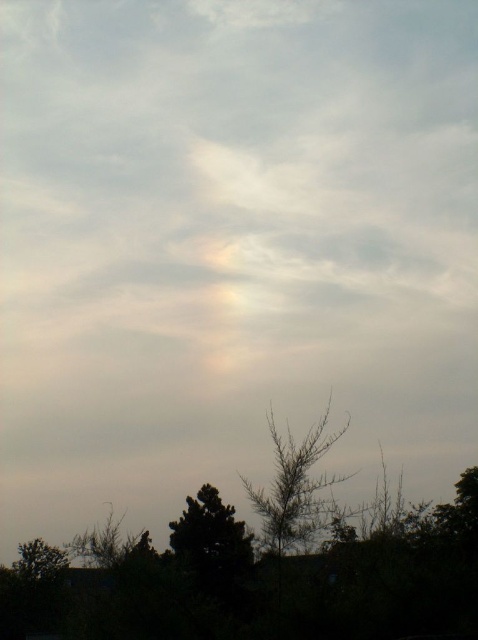
You are standing in a field and see the green leafy tree at center and the green matte tree at lower center. Which tree is positioned to the right side of the other?

The green leafy tree at center is positioned to the right of the green matte tree at lower center.

You are a bird flying in the sky and see two points, point (288, 545) and point (221, 534). Which point is closer to you?

Point (288, 545) is in front of point (221, 534), so it is closer to you.